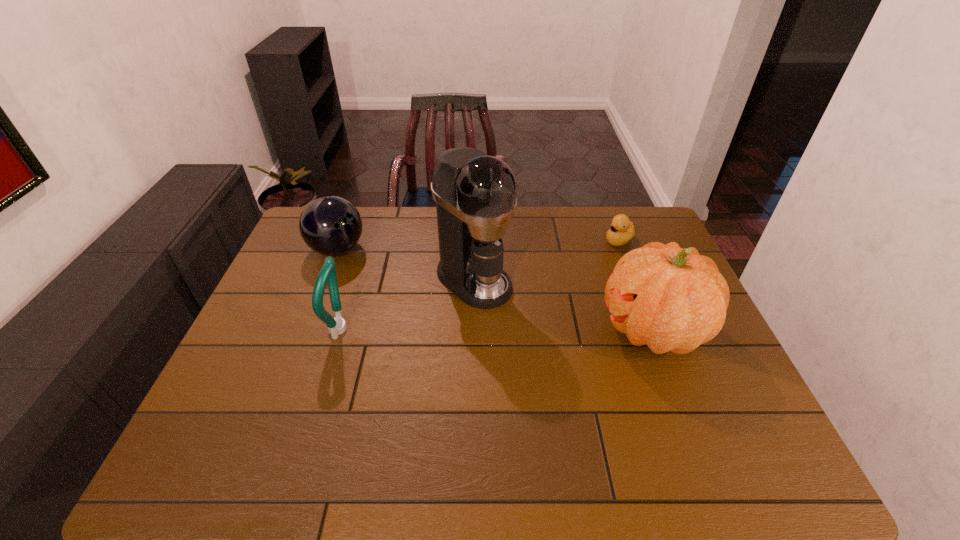
Identify the location of bottle opener. The height and width of the screenshot is (540, 960). (336, 326).

Locate an element on the screen. pumpkin is located at coordinates (671, 299).

This screenshot has width=960, height=540. Find the location of `duckling`. duckling is located at coordinates (622, 230).

This screenshot has height=540, width=960. What are the coordinates of `the fourth tallest object` in the screenshot? It's located at (330, 225).

Locate an element on the screen. The image size is (960, 540). the tallest object is located at coordinates point(475,194).

This screenshot has height=540, width=960. I want to click on the third object from right to left, so click(475, 194).

Where is `blank area located at the jaws of the bottle opener`? The height and width of the screenshot is (540, 960). blank area located at the jaws of the bottle opener is located at coordinates (421, 329).

Locate an element on the screen. This screenshot has height=540, width=960. vacant space located on the carved face of the second tallest object is located at coordinates (541, 329).

The image size is (960, 540). What are the coordinates of `vacant area situated 0.150m on the carved face of the second tallest object` in the screenshot? It's located at (545, 329).

The image size is (960, 540). Identify the location of vacant point located 0.260m on the carved face of the second tallest object. pyautogui.click(x=505, y=329).